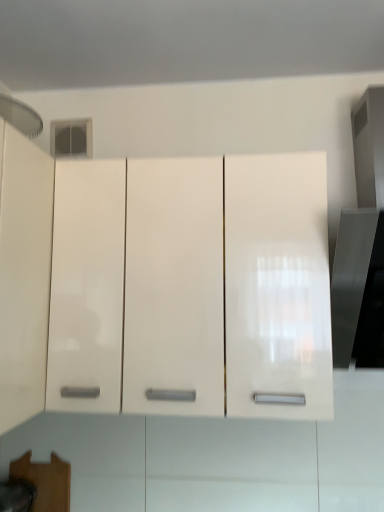
Question: Can you see brushed metal exhaust hood at upper left touching glossy white cabinet at center?

Choices:
 (A) yes
 (B) no

Answer: (B)

Question: Considering the relative positions of brushed metal exhaust hood at upper left and glossy white cabinet at center in the image provided, is brushed metal exhaust hood at upper left to the left of glossy white cabinet at center from the viewer's perspective?

Choices:
 (A) no
 (B) yes

Answer: (B)

Question: Does brushed metal exhaust hood at upper left come in front of glossy white cabinet at center?

Choices:
 (A) yes
 (B) no

Answer: (A)

Question: Is brushed metal exhaust hood at upper left wider than glossy white cabinet at center?

Choices:
 (A) yes
 (B) no

Answer: (B)

Question: Does brushed metal exhaust hood at upper left have a smaller size compared to glossy white cabinet at center?

Choices:
 (A) yes
 (B) no

Answer: (A)

Question: Considering the relative sizes of brushed metal exhaust hood at upper left and glossy white cabinet at center in the image provided, is brushed metal exhaust hood at upper left shorter than glossy white cabinet at center?

Choices:
 (A) no
 (B) yes

Answer: (B)

Question: Is glossy white cabinet at center taller than brushed metal exhaust hood at upper left?

Choices:
 (A) no
 (B) yes

Answer: (B)

Question: Is glossy white cabinet at center closer to camera compared to brushed metal exhaust hood at upper left?

Choices:
 (A) yes
 (B) no

Answer: (B)

Question: Can you confirm if glossy white cabinet at center is positioned to the left of brushed metal exhaust hood at upper left?

Choices:
 (A) yes
 (B) no

Answer: (B)

Question: Can you confirm if glossy white cabinet at center is bigger than brushed metal exhaust hood at upper left?

Choices:
 (A) yes
 (B) no

Answer: (A)

Question: Considering the relative sizes of glossy white cabinet at center and brushed metal exhaust hood at upper left in the image provided, is glossy white cabinet at center shorter than brushed metal exhaust hood at upper left?

Choices:
 (A) yes
 (B) no

Answer: (B)

Question: Is glossy white cabinet at center not close to brushed metal exhaust hood at upper left?

Choices:
 (A) no
 (B) yes

Answer: (A)

Question: Is point (198, 180) positioned closer to the camera than point (26, 124)?

Choices:
 (A) closer
 (B) farther

Answer: (A)